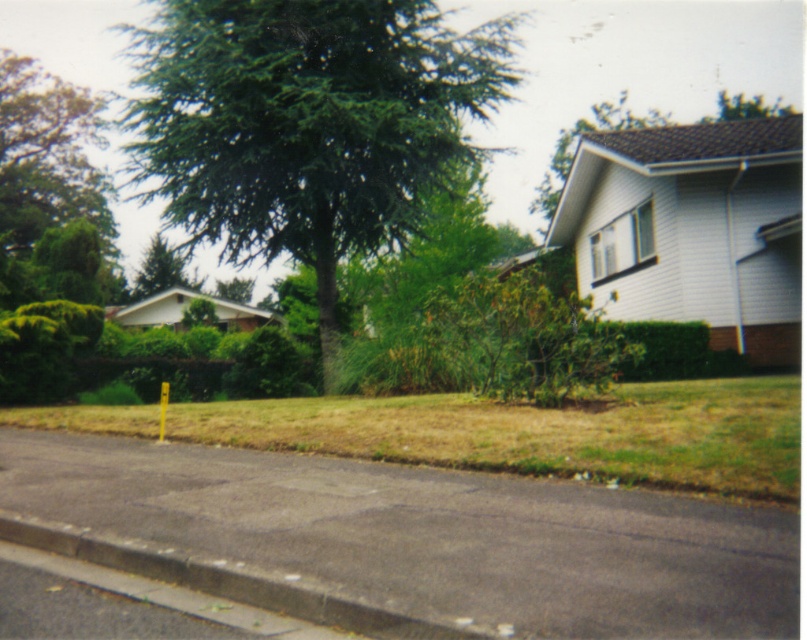
Question: Can you confirm if gray concrete curb at lower left is wider than green leafy tree at upper center?

Choices:
 (A) no
 (B) yes

Answer: (A)

Question: Considering the real-world distances, which object is farthest from the green needle-like at center?

Choices:
 (A) green matte tree at upper left
 (B) green leafy tree at upper center
 (C) gray concrete curb at lower left
 (D) yellow-green grass at lower center

Answer: (A)

Question: Which object is farther from the camera taking this photo?

Choices:
 (A) green needle-like at center
 (B) gray concrete curb at lower left

Answer: (A)

Question: Can you confirm if green needle-like at center is positioned above green matte tree at upper left?

Choices:
 (A) no
 (B) yes

Answer: (B)

Question: Among these points, which one is farthest from the camera?

Choices:
 (A) (383, 29)
 (B) (178, 269)
 (C) (642, 384)

Answer: (B)

Question: Does yellow-green grass at lower center have a smaller size compared to green matte tree at upper left?

Choices:
 (A) no
 (B) yes

Answer: (B)